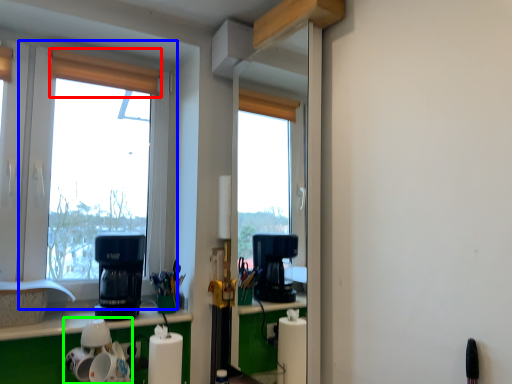
Question: Considering the real-world distances, which object is farthest from curtain (highlighted by a red box)? window (highlighted by a blue box) or appliance (highlighted by a green box)?

Choices:
 (A) window
 (B) appliance

Answer: (B)